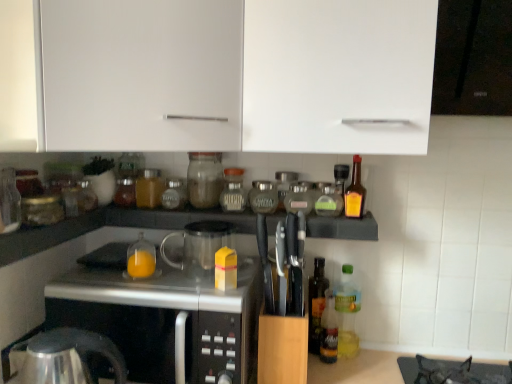
Where is `vacant area that lies to the right of translucent glass bottle at center, the 1th orange juice positioned from the back`? Image resolution: width=512 pixels, height=384 pixels. vacant area that lies to the right of translucent glass bottle at center, the 1th orange juice positioned from the back is located at coordinates (189, 283).